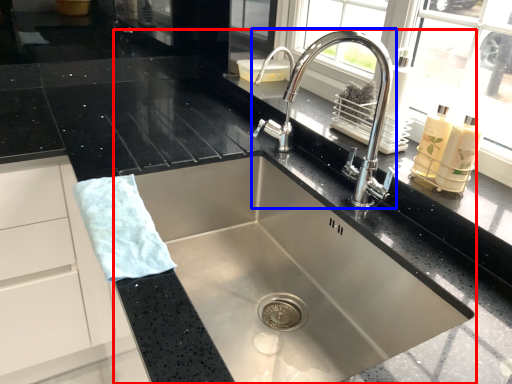
Question: Which point is closer to the camera, sink (highlighted by a red box) or tap (highlighted by a blue box)?

Choices:
 (A) sink
 (B) tap

Answer: (A)